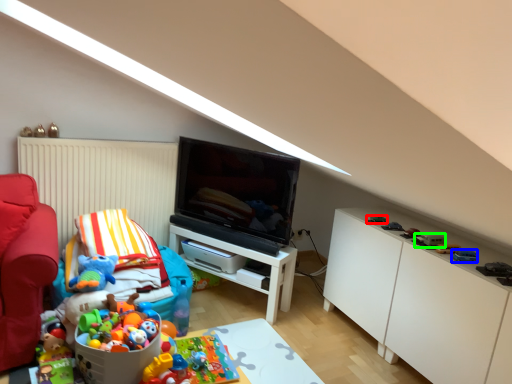
Question: Estimate the real-world distances between objects in this image. Which object is farther from toy (highlighted by a red box), toy (highlighted by a blue box) or toy (highlighted by a green box)?

Choices:
 (A) toy
 (B) toy

Answer: (A)